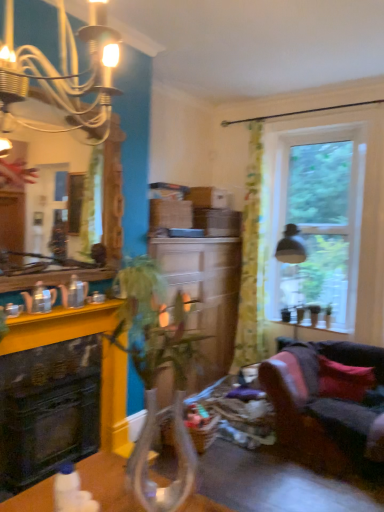
Question: From a real-world perspective, is velvet dark grey couch at lower right physically below translucent floral fabric curtain at right?

Choices:
 (A) yes
 (B) no

Answer: (A)

Question: From the image's perspective, is velvet dark grey couch at lower right located above translucent floral fabric curtain at right?

Choices:
 (A) yes
 (B) no

Answer: (B)

Question: From the image's perspective, does velvet dark grey couch at lower right appear lower than translucent floral fabric curtain at right?

Choices:
 (A) yes
 (B) no

Answer: (A)

Question: Are velvet dark grey couch at lower right and translucent floral fabric curtain at right beside each other?

Choices:
 (A) no
 (B) yes

Answer: (A)

Question: Considering the relative sizes of velvet dark grey couch at lower right and translucent floral fabric curtain at right in the image provided, is velvet dark grey couch at lower right shorter than translucent floral fabric curtain at right?

Choices:
 (A) no
 (B) yes

Answer: (B)

Question: From a real-world perspective, is velvet dark grey couch at lower right on translucent floral fabric curtain at right?

Choices:
 (A) yes
 (B) no

Answer: (B)

Question: Considering the relative sizes of green leafy plant at center and translucent floral fabric curtain at right in the image provided, is green leafy plant at center bigger than translucent floral fabric curtain at right?

Choices:
 (A) yes
 (B) no

Answer: (B)

Question: Is green leafy plant at center taller than translucent floral fabric curtain at right?

Choices:
 (A) no
 (B) yes

Answer: (A)

Question: Is translucent floral fabric curtain at right located within green leafy plant at center?

Choices:
 (A) no
 (B) yes

Answer: (A)

Question: Is green leafy plant at center thinner than translucent floral fabric curtain at right?

Choices:
 (A) yes
 (B) no

Answer: (B)

Question: From the image's perspective, does green leafy plant at center appear lower than translucent floral fabric curtain at right?

Choices:
 (A) yes
 (B) no

Answer: (A)

Question: Is green leafy plant at center oriented away from translucent floral fabric curtain at right?

Choices:
 (A) yes
 (B) no

Answer: (B)

Question: Is clear glass window at upper right further to the viewer compared to green leafy plant at center?

Choices:
 (A) yes
 (B) no

Answer: (A)